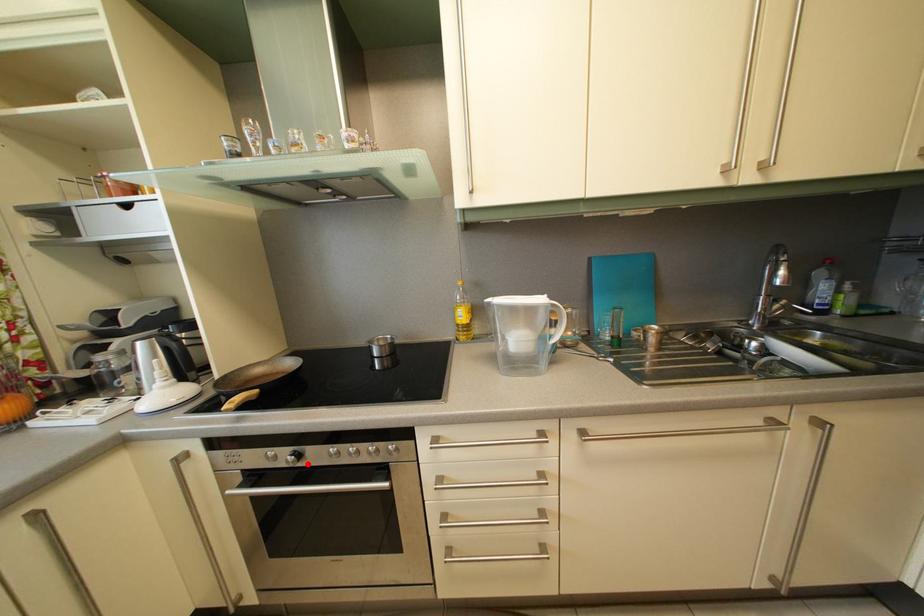
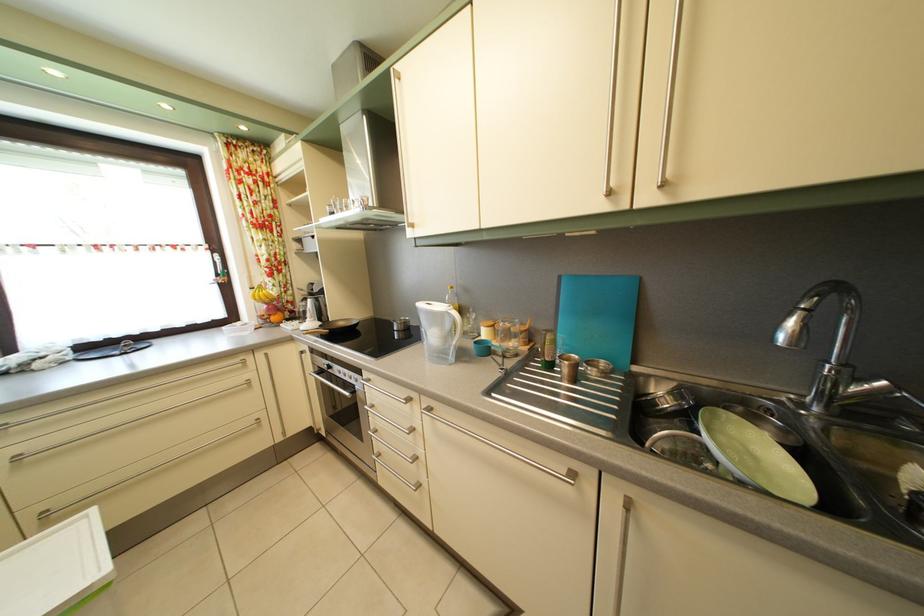
Find the pixel in the second image that matches the highlighted location in the first image.

(337, 374)